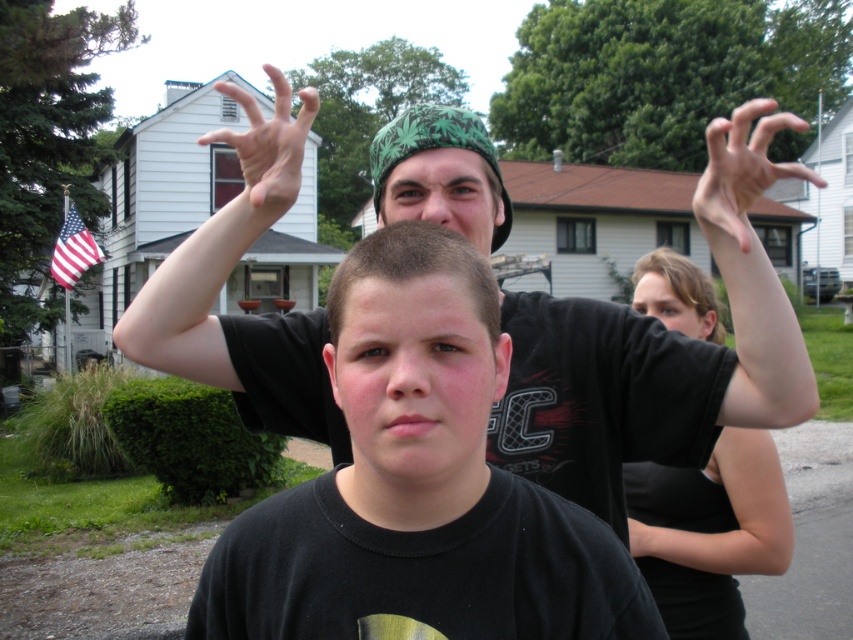
You are a photographer trying to capture a closeup of the black matte shirt at center and the pinkish skin tone hand at upper right in the image. Given that your camera can only focus on objects that are at least 10 cm thick, will both objects be in focus?

The black matte shirt at center is thinner than the pinkish skin tone hand at upper right. Since the camera requires objects to be at least 10 cm thick to focus, only the pinkish skin tone hand at upper right will be in focus as it meets the thickness requirement, while the black matte shirt at center may be too thin.

You are a photographer trying to capture a group photo. You notice the black matte shirt at center and the pinkish skin tone hand at upper right. Which object should you adjust to ensure both are in focus? Explain your reasoning.

The black matte shirt at center is positioned on the left side of the pinkish skin tone hand at upper right. To ensure both are in focus, adjust the camera focus to the black matte shirt at center since it is closer to the camera than the hand, which is further away. This will help maintain sharpness for both subjects within the depth of field.